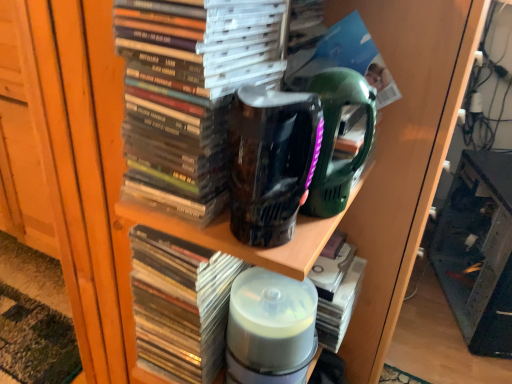
Question: Is translucent plastic container at center smaller than matte black book at center, arranged as the third book when ordered from the bottom?

Choices:
 (A) no
 (B) yes

Answer: (B)

Question: Is translucent plastic container at center in front of matte black book at center, the first book from the top?

Choices:
 (A) no
 (B) yes

Answer: (A)

Question: Is translucent plastic container at center oriented away from matte black book at center, the first book from the top?

Choices:
 (A) yes
 (B) no

Answer: (B)

Question: Is the depth of translucent plastic container at center greater than that of matte black book at center, arranged as the third book when ordered from the bottom?

Choices:
 (A) no
 (B) yes

Answer: (B)

Question: Can you confirm if translucent plastic container at center is shorter than matte black book at center, arranged as the third book when ordered from the bottom?

Choices:
 (A) no
 (B) yes

Answer: (B)

Question: From a real-world perspective, does translucent plastic container at center sit lower than matte black book at center, the first book from the top?

Choices:
 (A) no
 (B) yes

Answer: (B)

Question: Considering the relative sizes of black glossy mug at center and translucent plastic container at center in the image provided, is black glossy mug at center bigger than translucent plastic container at center?

Choices:
 (A) no
 (B) yes

Answer: (A)

Question: Can you confirm if black glossy mug at center is thinner than translucent plastic container at center?

Choices:
 (A) yes
 (B) no

Answer: (A)

Question: Considering the relative sizes of black glossy mug at center and translucent plastic container at center in the image provided, is black glossy mug at center shorter than translucent plastic container at center?

Choices:
 (A) no
 (B) yes

Answer: (B)

Question: Considering the relative sizes of black glossy mug at center and translucent plastic container at center in the image provided, is black glossy mug at center smaller than translucent plastic container at center?

Choices:
 (A) yes
 (B) no

Answer: (A)

Question: Is black glossy mug at center facing away from translucent plastic container at center?

Choices:
 (A) no
 (B) yes

Answer: (A)

Question: Is black glossy mug at center to the right of translucent plastic container at center from the viewer's perspective?

Choices:
 (A) no
 (B) yes

Answer: (A)

Question: Is matte black book at center, the first book from the top, positioned in front of translucent plastic books at center, which is counted as the second book, starting from the top?

Choices:
 (A) yes
 (B) no

Answer: (A)